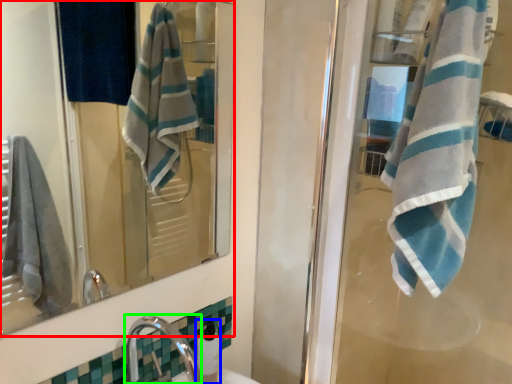
Question: Estimate the real-world distances between objects in this image. Which object is closer to mirror (highlighted by a red box), soap dispenser (highlighted by a blue box) or faucet (highlighted by a green box)?

Choices:
 (A) soap dispenser
 (B) faucet

Answer: (B)